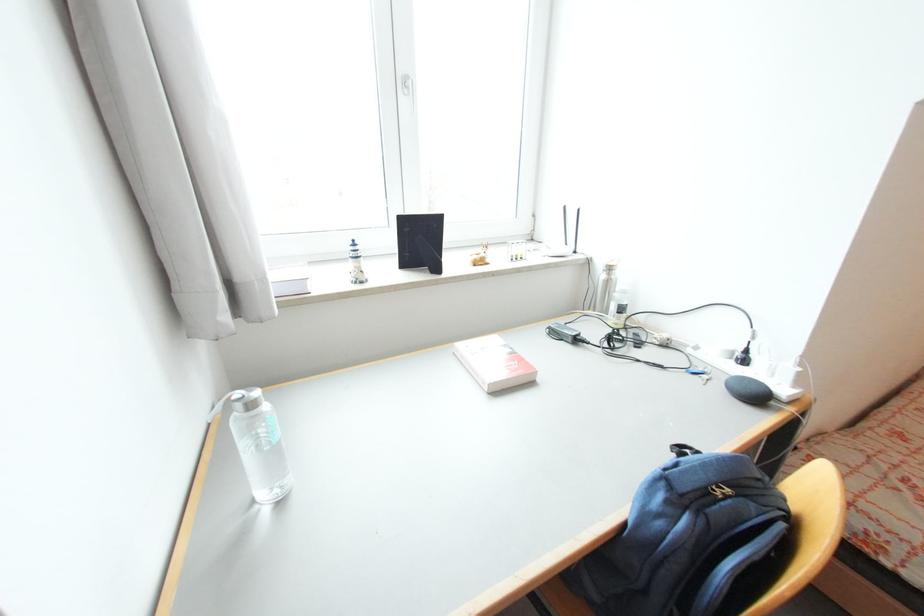
Describe the element at coordinates (493, 363) in the screenshot. I see `the red cover book` at that location.